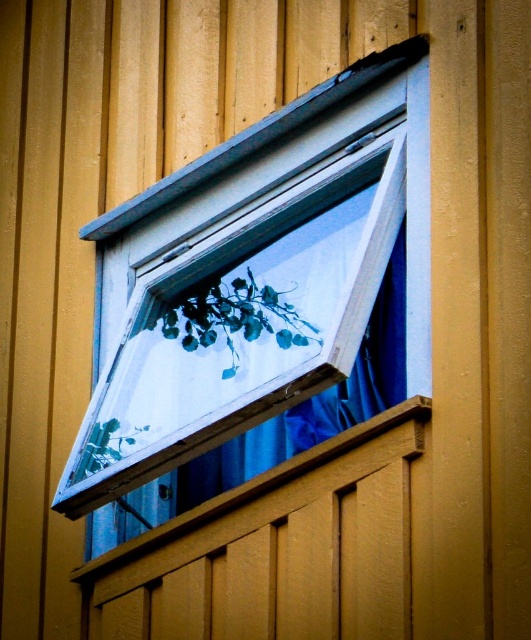
Question: Which object is the closest to the wooden at lower center?

Choices:
 (A) green matte plant at center
 (B) blue fabric curtain at upper center

Answer: (A)

Question: Is green matte plant at center thinner than wooden at lower center?

Choices:
 (A) yes
 (B) no

Answer: (A)

Question: Does blue fabric curtain at upper center appear over wooden at lower center?

Choices:
 (A) yes
 (B) no

Answer: (A)

Question: Considering the real-world distances, which object is farthest from the wooden at lower center?

Choices:
 (A) green matte plant at center
 (B) green leafy plant at lower left

Answer: (A)

Question: Which object is the farthest from the green matte plant at center?

Choices:
 (A) blue fabric curtain at upper center
 (B) white plastic window frame at upper center
 (C) green leafy plant at lower left
 (D) wooden at lower center

Answer: (B)

Question: Considering the relative positions of wooden at lower center and green leafy plant at lower left in the image provided, where is wooden at lower center located with respect to green leafy plant at lower left?

Choices:
 (A) left
 (B) right

Answer: (B)